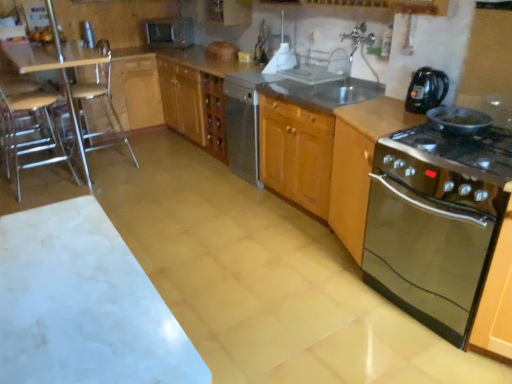
Question: Does point (378, 266) appear closer or farther from the camera than point (359, 248)?

Choices:
 (A) farther
 (B) closer

Answer: (B)

Question: Is black glass stove at right, the 2th kitchen appliance when ordered from top to bottom, in front of or behind stainless steel oven at right, the second cabinetry when ordered from back to front, in the image?

Choices:
 (A) front
 (B) behind

Answer: (A)

Question: Which of these objects is positioned farthest from the wooden seat at left, which is the first bar stool from left to right?

Choices:
 (A) white marble table at lower left, acting as the 1th table starting from the front
 (B) metallic silver toaster at upper left
 (C) black plastic kettle at upper right, arranged as the 1th kitchen appliance when viewed from the top
 (D) satin silver dishwasher at center
 (E) white glossy sink at center

Answer: (C)

Question: Considering the real-world distances, which object is farthest from the stainless steel oven at right, positioned as the 2th cabinetry in front-to-back order?

Choices:
 (A) black plastic kettle at upper right, arranged as the 1th kitchen appliance when viewed from the top
 (B) black glass stove at right, the 2th kitchen appliance when ordered from top to bottom
 (C) white glossy sink at center
 (D) clear plastic bar stool at left, the first bar stool viewed from the right
 (E) clear acrylic table at left, which appears as the 1th table when viewed from the top

Answer: (E)